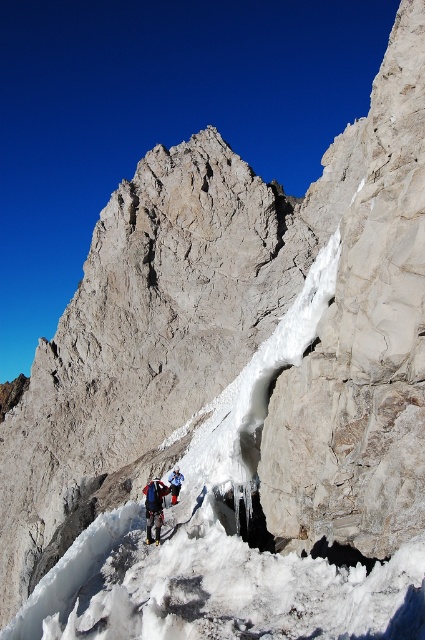
You are a mountain climber planning to ascend the icy path on the cliff. You have a red helmet and dark clothing on. There is a point marked at coordinates (153, 508). What object is located at this point?

The point at coordinates (153, 508) corresponds to the matte blue jacket at center.

You are a mountain guide assessing the safety of climbers on the icy path. You notice two climbers wearing jackets labeled as matte blue jacket at center and blue fabric jacket at lower center. Based on their jacket sizes, which climber might require additional gear to ensure stability on the narrow path?

The matte blue jacket at center might be wider than blue fabric jacket at lower center, so the climber wearing the matte blue jacket at center may need additional gear to ensure stability on the narrow path due to the potential width difference.